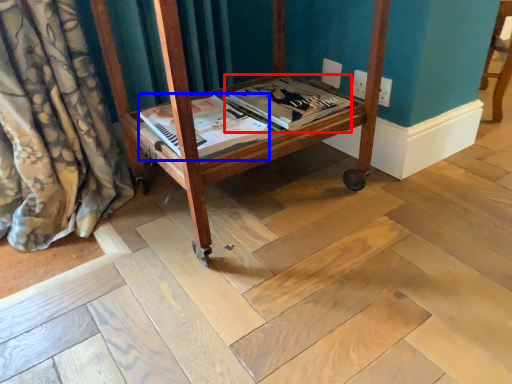
Question: Which object is closer to the camera taking this photo, magazine (highlighted by a red box) or magazine (highlighted by a blue box)?

Choices:
 (A) magazine
 (B) magazine

Answer: (B)